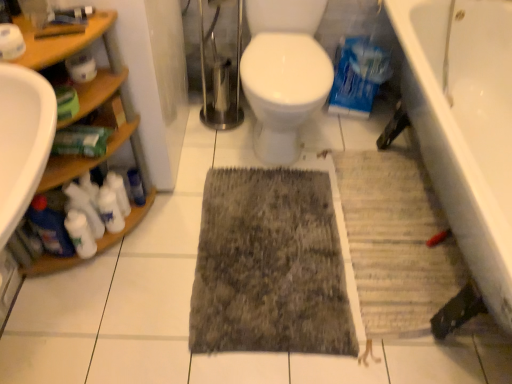
The image size is (512, 384). Identify the location of blank area to the left of dark gray textured rug at center. (135, 271).